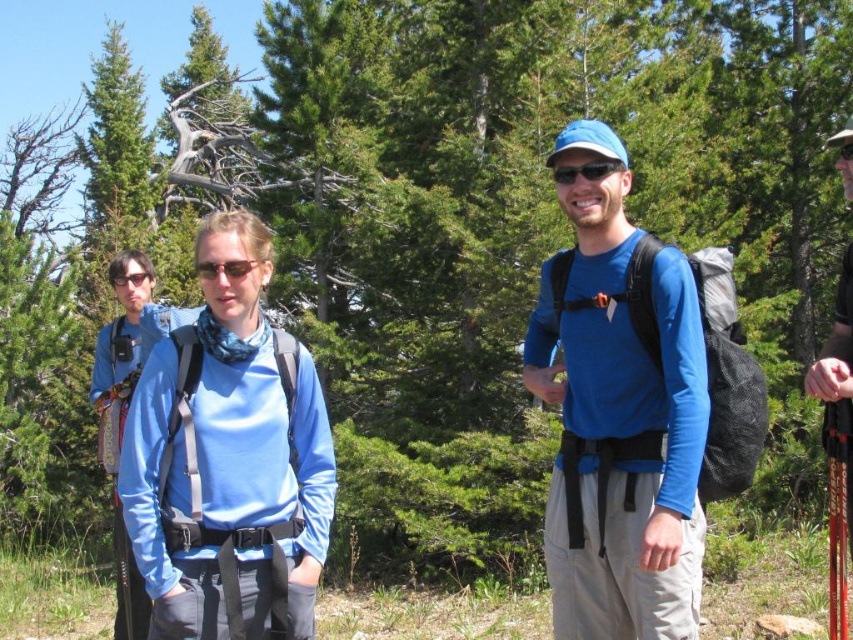
Question: Is blue fabric shirt at center wider than black matte sunglasses at center?

Choices:
 (A) yes
 (B) no

Answer: (A)

Question: Which object is positioned closest to the blue fabric jacket at center?

Choices:
 (A) blue fabric shirt at center
 (B) matte blue shirt at center

Answer: (A)

Question: Does blue fabric shirt at center have a larger size compared to matte blue shirt at center?

Choices:
 (A) yes
 (B) no

Answer: (A)

Question: Which point is closer to the camera?

Choices:
 (A) blue fabric jacket at center
 (B) blue fabric shirt at center
 (C) black matte sunglasses at center

Answer: (B)

Question: Estimate the real-world distances between objects in this image. Which object is farther from the matte blue shirt at center?

Choices:
 (A) black matte sunglasses at center
 (B) blue fabric shirt at center

Answer: (A)

Question: Can you confirm if matte blue shirt at center is thinner than blue fabric jacket at center?

Choices:
 (A) no
 (B) yes

Answer: (A)